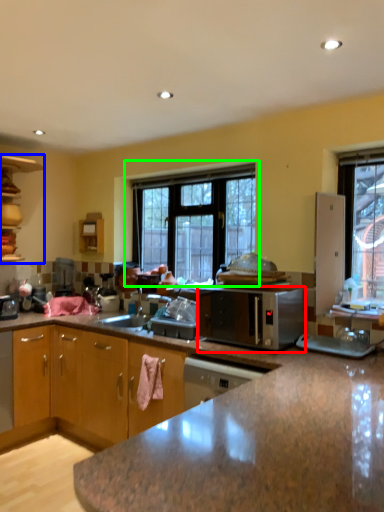
Question: Estimate the real-world distances between objects in this image. Which object is closer to microwave oven (highlighted by a red box), cabinetry (highlighted by a blue box) or window (highlighted by a green box)?

Choices:
 (A) cabinetry
 (B) window

Answer: (B)